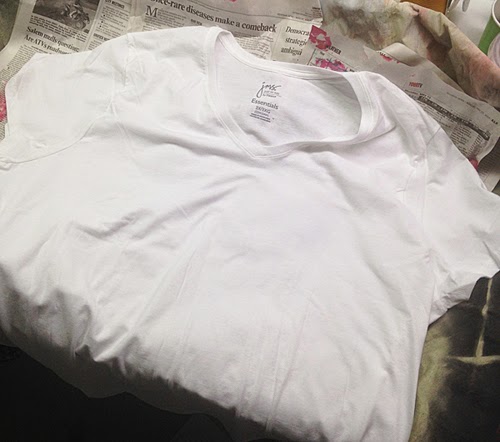
Locate an element on the screen. The height and width of the screenshot is (442, 500). tablecloth is located at coordinates (467, 58).